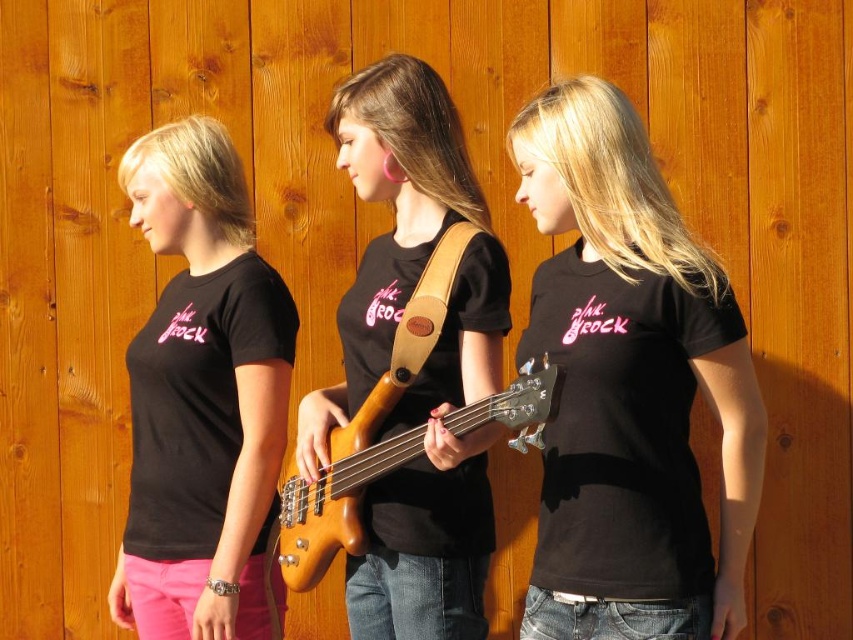
Who is positioned more to the left, black matte t-shirt at center or black matte t-shirt at left?

From the viewer's perspective, black matte t-shirt at left appears more on the left side.

Can you confirm if black matte t-shirt at center is smaller than black matte t-shirt at left?

Indeed, black matte t-shirt at center has a smaller size compared to black matte t-shirt at left.

Does point (692, 292) come behind point (190, 269)?

No, it is not.

The image size is (853, 640). In order to click on black matte t-shirt at center in this screenshot , I will do `click(630, 387)`.

Is black matte t-shirt at center wider than light brown wood guitar at center?

No, black matte t-shirt at center is not wider than light brown wood guitar at center.

Where is `black matte t-shirt at center`? This screenshot has height=640, width=853. black matte t-shirt at center is located at coordinates (630, 387).

Identify the location of black matte t-shirt at center. Image resolution: width=853 pixels, height=640 pixels. (630, 387).

Is black matte t-shirt at left below light brown wood guitar at center?

No, black matte t-shirt at left is not below light brown wood guitar at center.

Find the location of a particular element. This screenshot has width=853, height=640. black matte t-shirt at left is located at coordinates (201, 396).